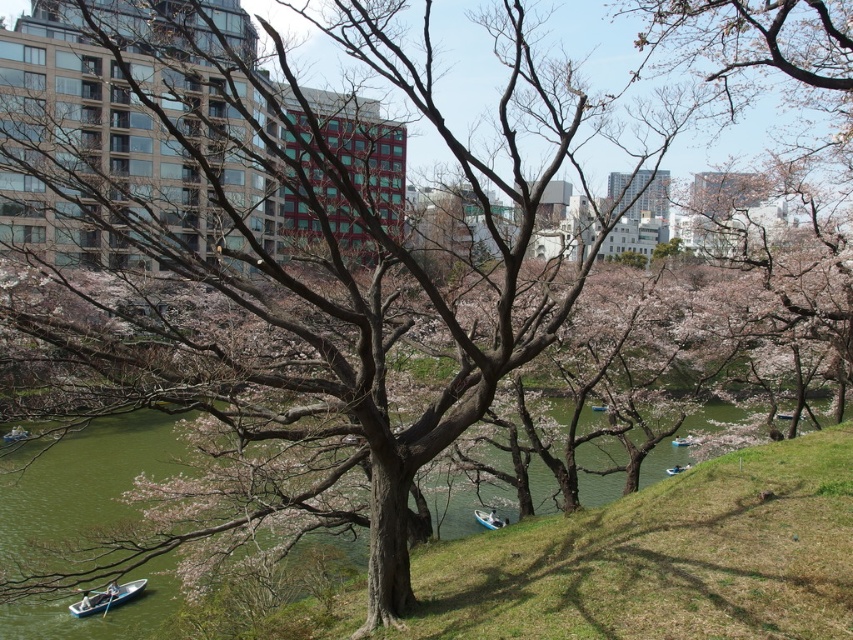
Image resolution: width=853 pixels, height=640 pixels. What do you see at coordinates (683, 440) in the screenshot?
I see `white plastic boat at center` at bounding box center [683, 440].

Consider the image. Which is above, white plastic boat at center or white plastic boat at lower right?

Positioned higher is white plastic boat at center.

Is point (682, 440) more distant than point (666, 468)?

No.

The height and width of the screenshot is (640, 853). Find the location of `white plastic boat at center`. white plastic boat at center is located at coordinates pos(683,440).

Between point (495, 522) and point (679, 468), which one is positioned in front?

Point (495, 522) is more forward.

Identify the location of white plastic boat at lower center. (490, 518).

Does point (486, 513) come behind point (671, 472)?

No, (486, 513) is closer to viewer.

This screenshot has height=640, width=853. Identify the location of white plastic boat at lower center. (490, 518).

In the scene shown: Does white plastic boat at lower left appear over white plastic boat at lower right?

No, white plastic boat at lower left is not above white plastic boat at lower right.

Measure the distance between white plastic boat at lower left and white plastic boat at lower right.

They are 18.19 meters apart.

Is point (80, 596) positioned in front of point (677, 474)?

Yes, it is in front of point (677, 474).

The width and height of the screenshot is (853, 640). In order to click on white plastic boat at lower left in this screenshot , I will do `click(105, 596)`.